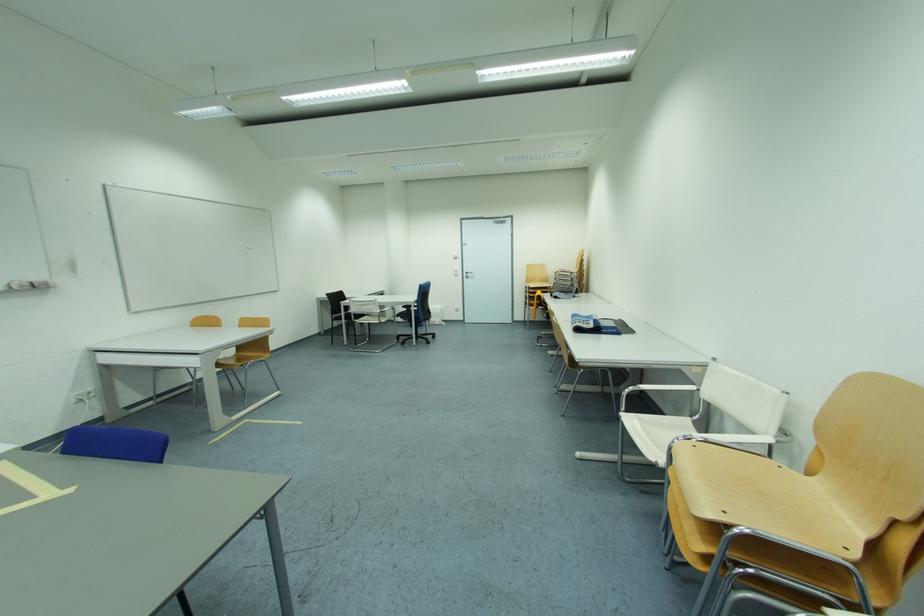
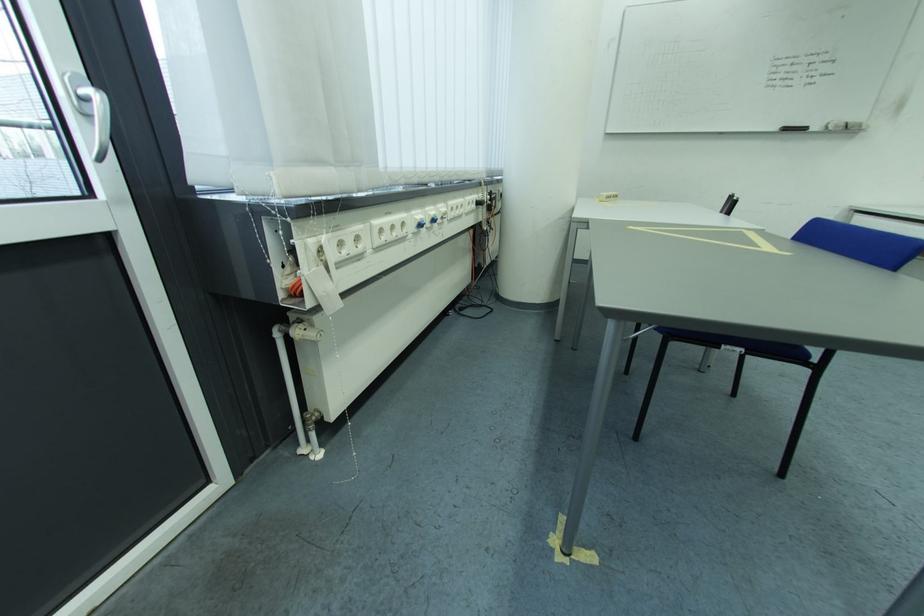
Where in the second image is the point corresponding to point (30, 289) from the first image?

(845, 129)